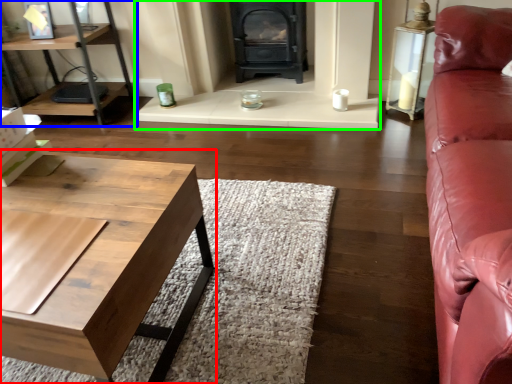
Question: Which is nearer to the coffee table (highlighted by a red box)? shelf (highlighted by a blue box) or fireplace (highlighted by a green box).

Choices:
 (A) shelf
 (B) fireplace

Answer: (B)